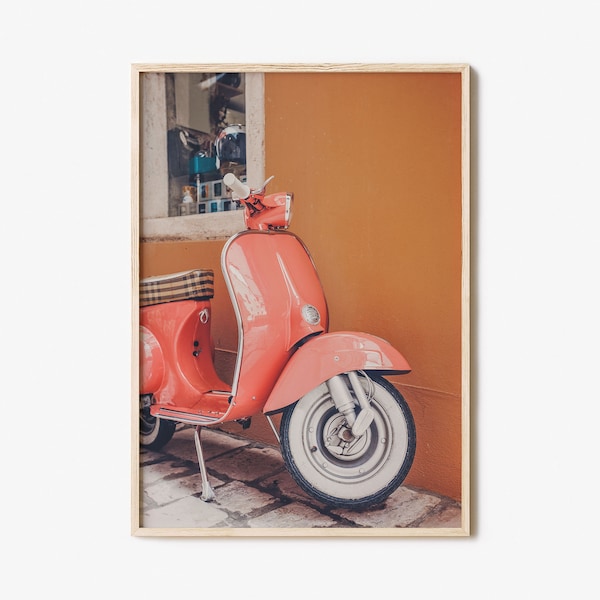
Locate an element on the screen. The width and height of the screenshot is (600, 600). window is located at coordinates (174, 101).